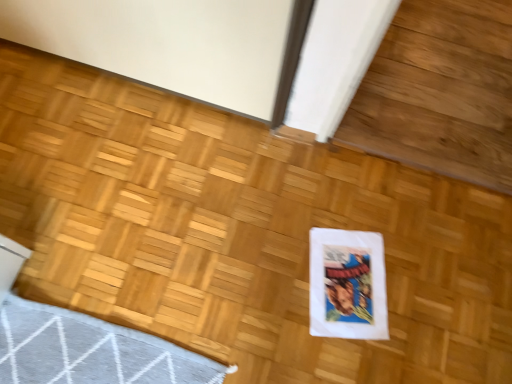
You are a GUI agent. You are given a task and a screenshot of the screen. Output one action in this format:
    pyautogui.click(x=<x>, y=<y>)
    Task: Click on the blank area to the left of white paper comic book at lower right
    This screenshot has width=512, height=384.
    Given the screenshot: What is the action you would take?
    pyautogui.click(x=270, y=271)